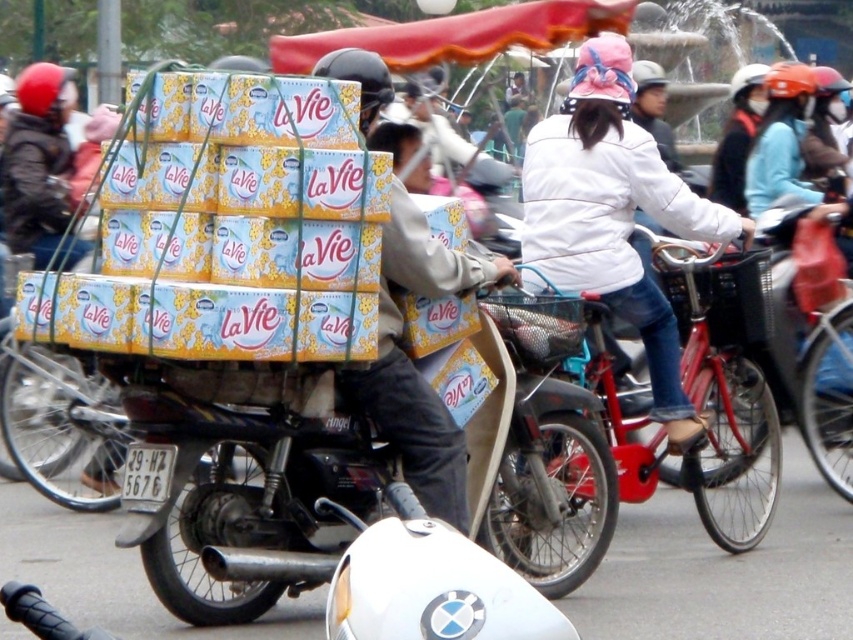
Does white matte jacket at center have a greater height compared to red matte bicycle at center?

Yes, white matte jacket at center is taller than red matte bicycle at center.

Can you confirm if white matte jacket at center is smaller than red matte bicycle at center?

Correct, white matte jacket at center occupies less space than red matte bicycle at center.

Is point (688, 419) positioned behind point (726, 486)?

No, (688, 419) is in front of (726, 486).

Locate an element on the screen. Image resolution: width=853 pixels, height=640 pixels. white matte jacket at center is located at coordinates (614, 216).

Does metallic silver motorcycle at center lie in front of red matte bicycle at center?

Yes, metallic silver motorcycle at center is in front of red matte bicycle at center.

Measure the distance between metallic silver motorcycle at center and red matte bicycle at center.

A distance of 2.19 meters exists between metallic silver motorcycle at center and red matte bicycle at center.

You are a GUI agent. You are given a task and a screenshot of the screen. Output one action in this format:
    pyautogui.click(x=<x>, y=<y>)
    Task: Click on the metallic silver motorcycle at center
    The width and height of the screenshot is (853, 640).
    Given the screenshot: What is the action you would take?
    pyautogui.click(x=253, y=502)

This screenshot has height=640, width=853. I want to click on metallic silver motorcycle at center, so (253, 502).

Who is lower down, metallic silver motorcycle at center or white matte jacket at center?

metallic silver motorcycle at center

Who is positioned more to the left, metallic silver motorcycle at center or white matte jacket at center?

From the viewer's perspective, metallic silver motorcycle at center appears more on the left side.

Between point (230, 440) and point (531, 163), which one is positioned in front?

Point (230, 440)

Find the location of a particular element. The width and height of the screenshot is (853, 640). metallic silver motorcycle at center is located at coordinates (253, 502).